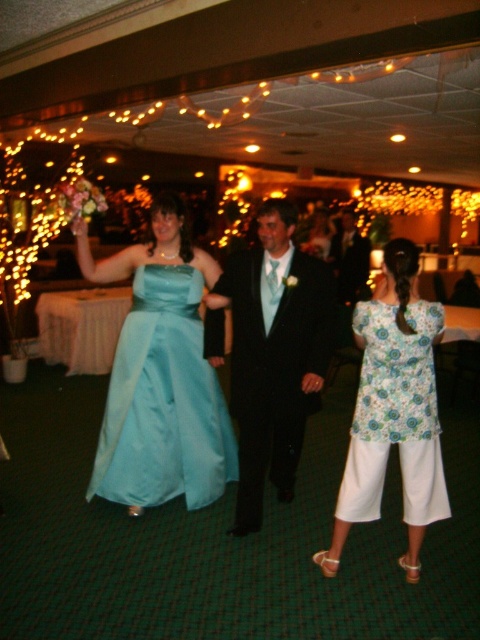
Does point (265, 380) lie behind point (219, 406)?

No.

Which is behind, point (235, 397) or point (206, 392)?

Positioned behind is point (206, 392).

Does point (288, 390) come behind point (183, 449)?

No, (288, 390) is in front of (183, 449).

The image size is (480, 640). Find the location of `shiny black suit at center`. shiny black suit at center is located at coordinates (272, 353).

Who is positioned more to the left, matte blue dress at center or floral fabric blouse at center?

matte blue dress at center is more to the left.

Between point (359, 339) and point (360, 467), which one is positioned behind?

Point (359, 339)

You are a GUI agent. You are given a task and a screenshot of the screen. Output one action in this format:
    pyautogui.click(x=<x>, y=<y>)
    Task: Click on the matte blue dress at center
    This screenshot has height=640, width=480.
    Given the screenshot: What is the action you would take?
    pyautogui.click(x=394, y=410)

Where is `matte blue dress at center`? matte blue dress at center is located at coordinates tap(394, 410).

Can you confirm if shiny black suit at center is shorter than floral fabric blouse at center?

Incorrect, shiny black suit at center's height does not fall short of floral fabric blouse at center's.

Does shiny black suit at center have a lesser width compared to floral fabric blouse at center?

No, shiny black suit at center is not thinner than floral fabric blouse at center.

Measure the distance between shiny black suit at center and camera.

shiny black suit at center is 2.67 meters away from camera.

Where is `shiny black suit at center`? Image resolution: width=480 pixels, height=640 pixels. shiny black suit at center is located at coordinates (272, 353).